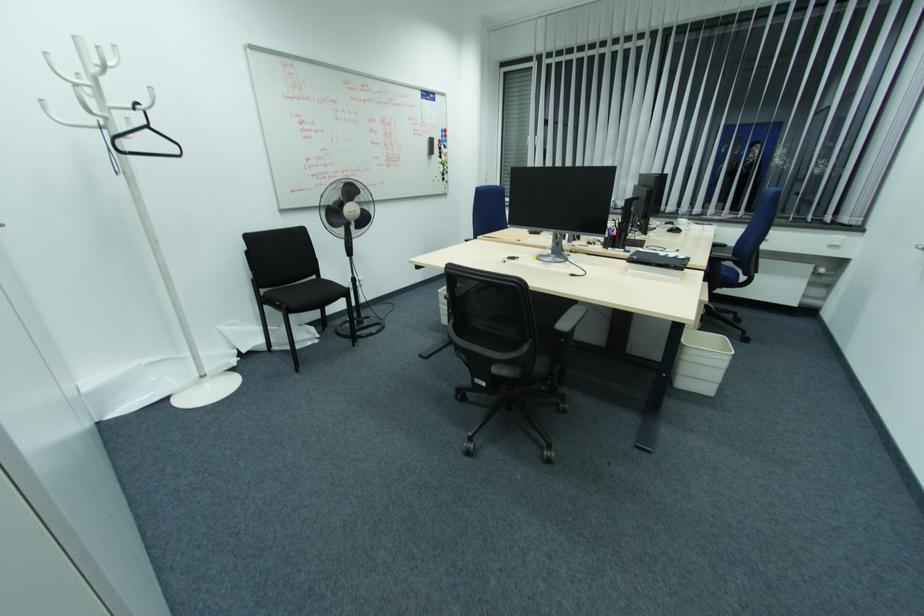
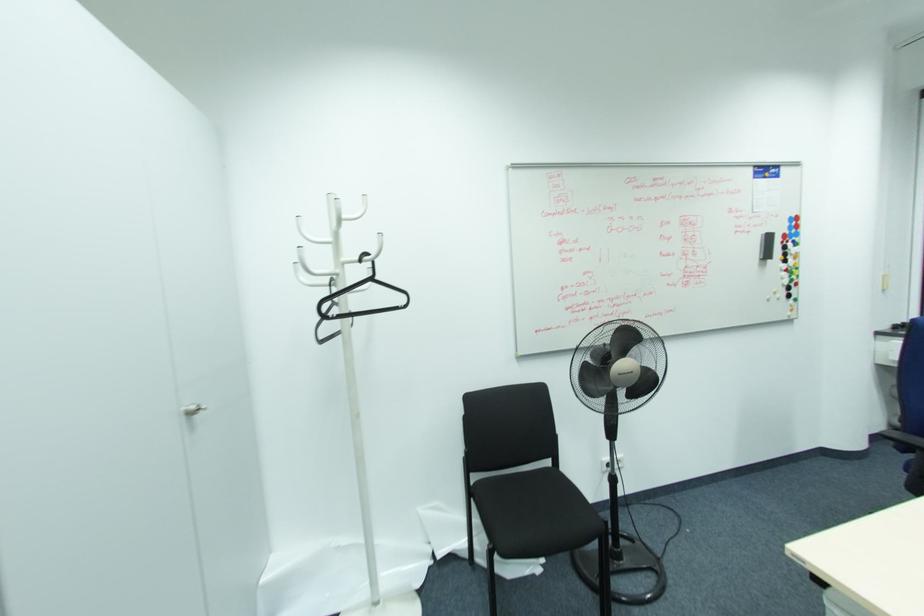
Locate, in the second image, the point that corresponds to (432,152) in the first image.

(768, 256)